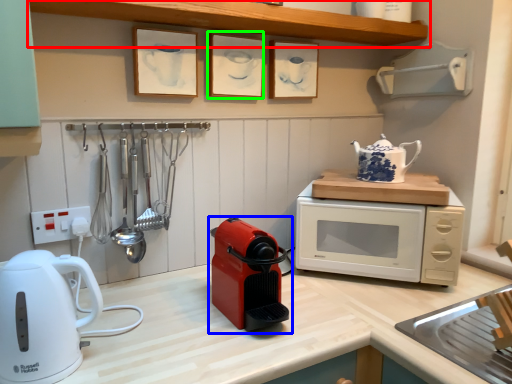
Question: Which object is positioned farthest from shelf (highlighted by a red box)? Select from home appliance (highlighted by a blue box) and picture frame (highlighted by a green box).

Choices:
 (A) home appliance
 (B) picture frame

Answer: (A)